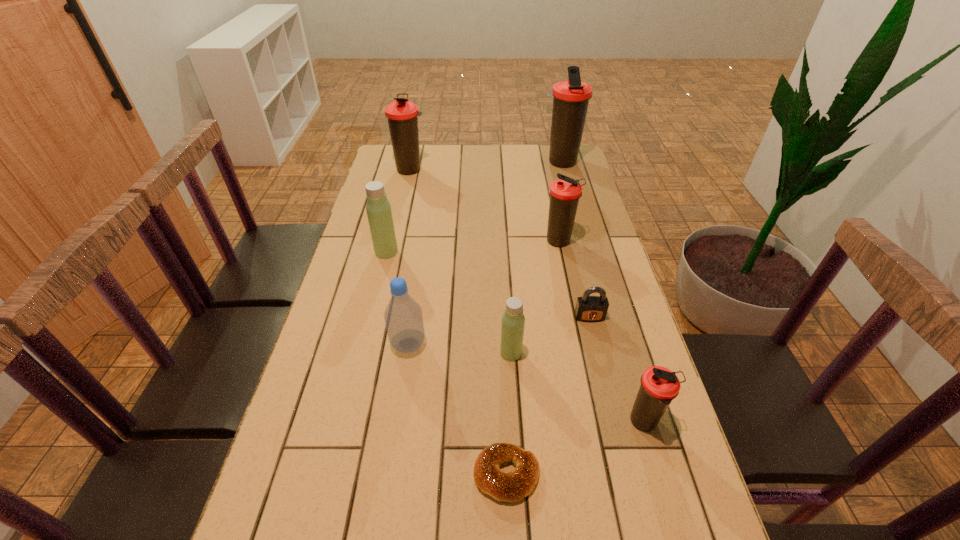
Identify the location of object that is the fourth closest one to the gray bottle. The width and height of the screenshot is (960, 540). click(588, 308).

Identify which thermos bottle is the third closest to the farther light thermos bottle. Please provide its 2D coordinates. Your answer should be formatted as a tuple, i.e. [(x, y)], where the tuple contains the x and y coordinates of a point satisfying the conditions above.

[(565, 192)]

This screenshot has width=960, height=540. What are the coordinates of `the third closest thermos bottle to the bottle` in the screenshot? It's located at (565, 192).

The image size is (960, 540). I want to click on brown thermos bottle that stands as the third closest to the gray padlock, so click(x=571, y=98).

This screenshot has width=960, height=540. Identify the location of brown thermos bottle that is the third closest to the farther light thermos bottle. (571, 98).

Locate an element on the screen. The width and height of the screenshot is (960, 540). vacant area that satisfies the following two spatial constraints: 1. on the back side of the tallest object; 2. on the right side of the third biggest brown thermos bottle is located at coordinates pyautogui.click(x=542, y=163).

Locate an element on the screen. The image size is (960, 540). free space that satisfies the following two spatial constraints: 1. on the front side of the second nearest brown thermos bottle; 2. on the left side of the nearest brown thermos bottle is located at coordinates (597, 422).

Where is `vacant space that satisfies the following two spatial constraints: 1. on the back side of the tallest object; 2. on the left side of the bigger light thermos bottle`? vacant space that satisfies the following two spatial constraints: 1. on the back side of the tallest object; 2. on the left side of the bigger light thermos bottle is located at coordinates (408, 163).